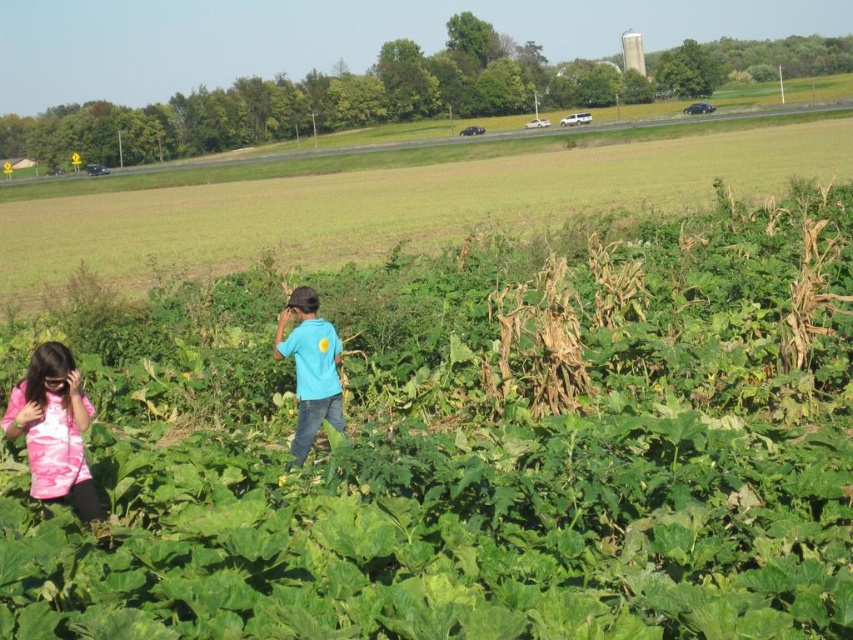
You are a parent trying to locate your children in a garden. You see the green leafy plant at center and the matte blue shirt at center. Which object is taller?

The green leafy plant at center is taller than the matte blue shirt at center.